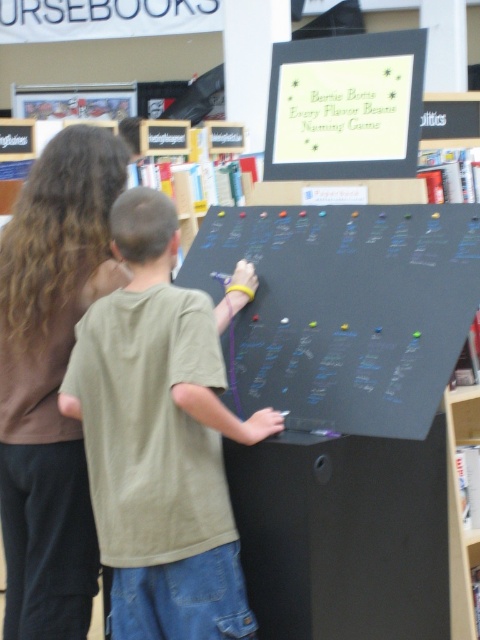
Does green cotton shirt at center have a lesser height compared to black chalkboard at center?

In fact, green cotton shirt at center may be taller than black chalkboard at center.

What are the coordinates of `green cotton shirt at center` in the screenshot? It's located at (159, 440).

Describe the element at coordinates (159, 440) in the screenshot. I see `green cotton shirt at center` at that location.

Which is more to the right, green cotton shirt at center or matte black board at upper center?

Positioned to the right is matte black board at upper center.

Image resolution: width=480 pixels, height=640 pixels. I want to click on green cotton shirt at center, so click(x=159, y=440).

The image size is (480, 640). What are the coordinates of `green cotton shirt at center` in the screenshot? It's located at (159, 440).

Can you confirm if black chalkboard at center is thinner than matte black board at upper center?

Incorrect, black chalkboard at center's width is not less than matte black board at upper center's.

Between black chalkboard at center and matte black board at upper center, which one is positioned higher?

matte black board at upper center is higher up.

Which is in front, point (420, 209) or point (294, 67)?

Point (420, 209)

This screenshot has height=640, width=480. What are the coordinates of `black chalkboard at center` in the screenshot? It's located at (345, 308).